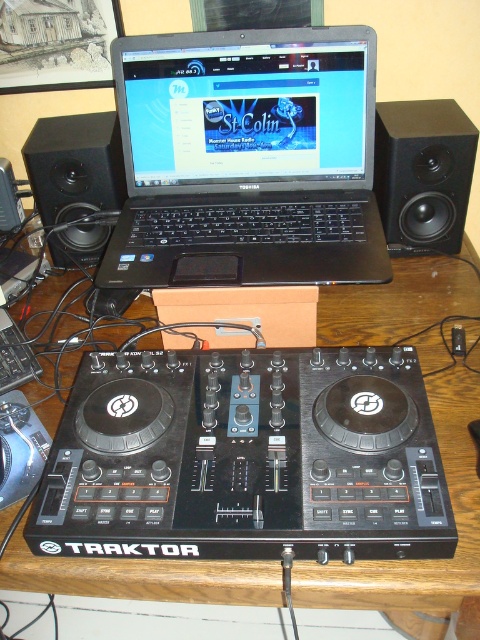
You are a GUI agent. You are given a task and a screenshot of the screen. Output one action in this format:
    pyautogui.click(x=<x>, y=<y>)
    Task: Click on the black matte speaker at right
    
    Given the screenshot: What is the action you would take?
    pyautogui.click(x=422, y=173)

This screenshot has width=480, height=640. What do you see at coordinates (422, 173) in the screenshot?
I see `black matte speaker at right` at bounding box center [422, 173].

The image size is (480, 640). Find the location of `black matte speaker at right`. black matte speaker at right is located at coordinates (422, 173).

Can you confirm if black plastic dj controller at center is smaller than black matte speaker at right?

Actually, black plastic dj controller at center might be larger than black matte speaker at right.

Who is more distant from viewer, (240, 541) or (385, 148)?

Positioned behind is point (385, 148).

Locate an element on the screen. Image resolution: width=480 pixels, height=640 pixels. black plastic dj controller at center is located at coordinates point(245,458).

Is black plastic laptop at center above black matte speaker at right?

Incorrect, black plastic laptop at center is not positioned above black matte speaker at right.

Is black plastic laptop at center to the left of black matte speaker at right from the viewer's perspective?

Indeed, black plastic laptop at center is positioned on the left side of black matte speaker at right.

Where is `black plastic laptop at center`? Image resolution: width=480 pixels, height=640 pixels. black plastic laptop at center is located at coordinates (247, 157).